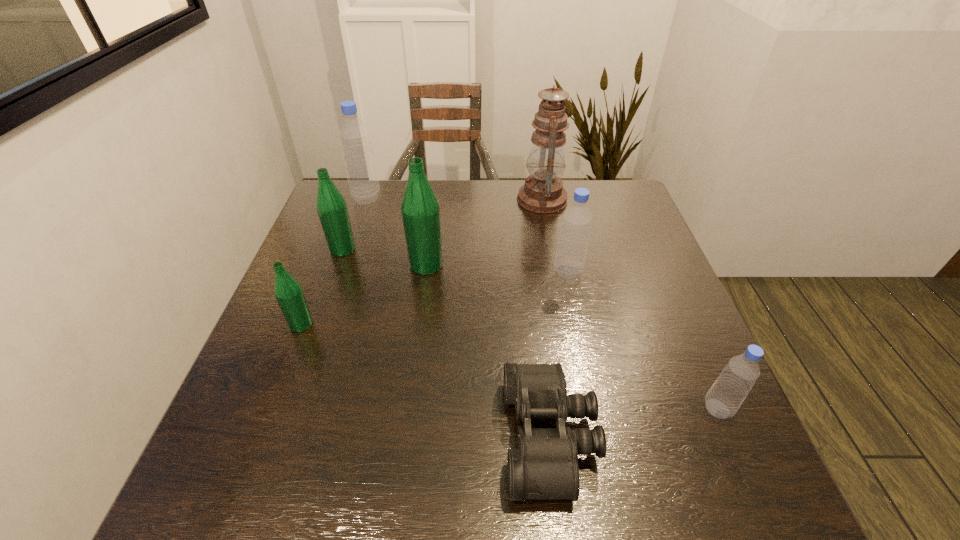
I want to click on free space located 0.250m on the left of the rightmost bottle, so click(573, 409).

Locate an element on the screen. Image resolution: width=960 pixels, height=540 pixels. vacant space located at the eyepieces of the black binoculars is located at coordinates (435, 436).

At what (x,y) coordinates should I click in order to perform the action: click on vacant space located at the eyepieces of the black binoculars. Please return your answer as a coordinate pair (x, y). Looking at the image, I should click on (298, 436).

You are a GUI agent. You are given a task and a screenshot of the screen. Output one action in this format:
    pyautogui.click(x=<x>, y=<y>)
    Task: Click on the free space located at the eyepieces of the black binoculars
    The height and width of the screenshot is (540, 960).
    Given the screenshot: What is the action you would take?
    (x=286, y=436)

This screenshot has width=960, height=540. I want to click on oil lamp present at the far edge, so click(x=543, y=192).

Locate an element on the screen. The width and height of the screenshot is (960, 540). bottle present at the far edge is located at coordinates (354, 136).

Find the location of a particular element. object located in the near edge section of the desktop is located at coordinates (545, 466).

In order to click on object that is at the right edge in this screenshot , I will do `click(724, 398)`.

Where is `object situated at the far left corner`? The width and height of the screenshot is (960, 540). object situated at the far left corner is located at coordinates (354, 136).

This screenshot has height=540, width=960. In the image, there is a desktop. Identify the location of vacant space at the far edge. (571, 198).